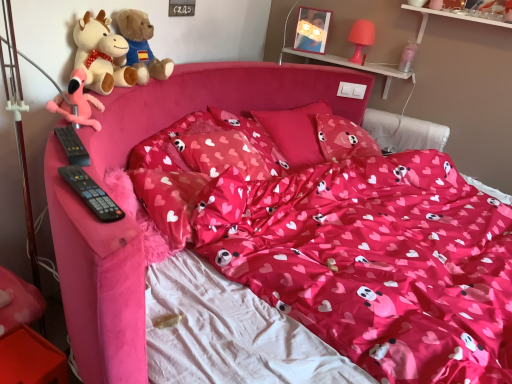
Question: From the image's perspective, is soft plush teddy bear at upper left, the first teddy bear from the front, located above or below black plastic remote control at left, the 1th remote control viewed from the front?

Choices:
 (A) above
 (B) below

Answer: (A)

Question: In terms of size, does soft plush teddy bear at upper left, the second teddy bear positioned from the back, appear bigger or smaller than black plastic remote control at left, which is the second remote control in top-to-bottom order?

Choices:
 (A) big
 (B) small

Answer: (A)

Question: Which is nearer to the black plastic remote control at left, the 1th remote control viewed from the front?

Choices:
 (A) clear plastic bottle at upper right, which is counted as the 2th toy, starting from the front
 (B) pink fabric pillow at center, which is the third pillow in front-to-back order
 (C) wooden picture frame at upper center
 (D) matte pink pillow at center, which ranks as the first pillow in back-to-front order
 (E) fluffy pink flamingo at left, which is the first toy from bottom to top

Answer: (E)

Question: Which of these objects is positioned farthest from the shiny pink fabric at center?

Choices:
 (A) clear plastic bottle at upper right, marked as the 2th toy in a left-to-right arrangement
 (B) matte pink pillow at center, which is the 2th pillow from front to back
 (C) wooden picture frame at upper center
 (D) pink fabric pillow at center, which is the third pillow in front-to-back order
 (E) matte pink pillow at center, which ranks as the first pillow in back-to-front order

Answer: (C)